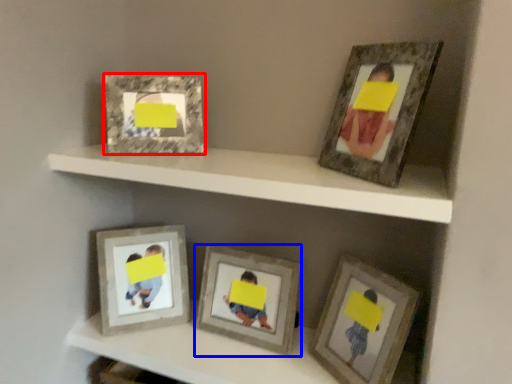
Question: Which object is closer to the camera taking this photo, picture frame (highlighted by a red box) or picture frame (highlighted by a blue box)?

Choices:
 (A) picture frame
 (B) picture frame

Answer: (A)